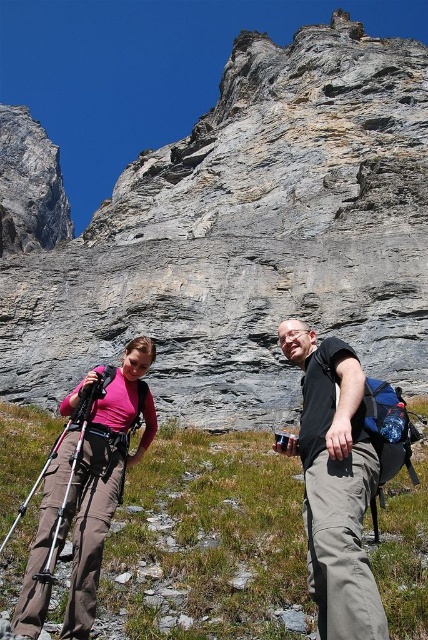
Does green grassy at center appear on the right side of matte pink shirt at lower left?

Yes, green grassy at center is to the right of matte pink shirt at lower left.

Does green grassy at center appear over matte pink shirt at lower left?

No.

Where is `green grassy at center`? The image size is (428, 640). green grassy at center is located at coordinates (208, 541).

Consider the image. Between gray rock formation at center and matte pink shirt at lower left, which one is positioned lower?

matte pink shirt at lower left is lower down.

Is point (148, 163) positioned after point (51, 467)?

That is True.

Between point (130, 257) and point (101, 509), which one is positioned in front?

Point (101, 509) is in front.

You are a GUI agent. You are given a task and a screenshot of the screen. Output one action in this format:
    pyautogui.click(x=<x>, y=<y>)
    Task: Click on the gray rock formation at center
    
    Given the screenshot: What is the action you would take?
    pyautogui.click(x=247, y=237)

Can you confirm if green grassy at center is wider than black cotton shirt at center?

Yes, green grassy at center is wider than black cotton shirt at center.

Can you confirm if green grassy at center is taller than black cotton shirt at center?

In fact, green grassy at center may be shorter than black cotton shirt at center.

The image size is (428, 640). I want to click on green grassy at center, so click(208, 541).